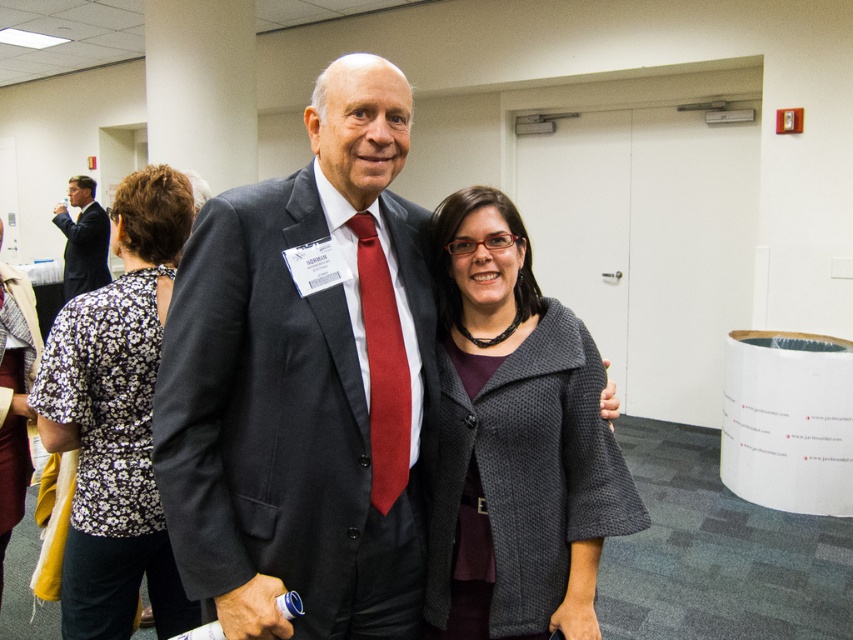
Question: Can you confirm if dark gray wool suit at center is positioned to the left of matte red tie at center?

Choices:
 (A) yes
 (B) no

Answer: (A)

Question: Estimate the real-world distances between objects in this image. Which object is farther from the dark gray wool suit at center?

Choices:
 (A) matte red tie at center
 (B) floral fabric blouse at left
 (C) matte black suit at left
 (D) dark gray textured coat at center

Answer: (C)

Question: Can you confirm if dark gray wool suit at center is positioned above floral fabric blouse at left?

Choices:
 (A) yes
 (B) no

Answer: (A)

Question: Which object is closer to the camera taking this photo?

Choices:
 (A) dark gray textured coat at center
 (B) matte black suit at center

Answer: (B)

Question: Which is farther from the matte red tie at center?

Choices:
 (A) matte black suit at left
 (B) floral fabric blouse at left

Answer: (A)

Question: Does dark gray wool suit at center appear on the left side of matte black suit at left?

Choices:
 (A) no
 (B) yes

Answer: (A)